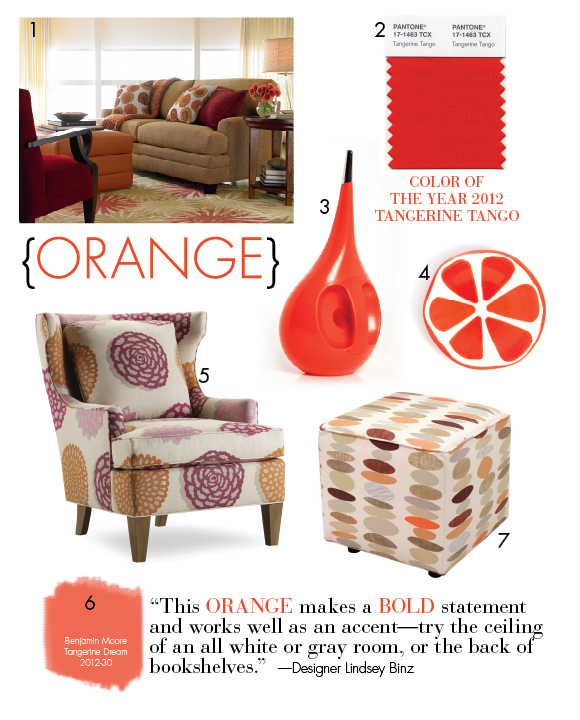
Locate an element on the screen. The image size is (580, 720). livingroom design is located at coordinates (166, 176).